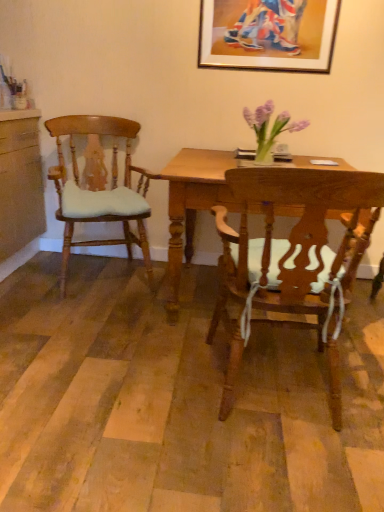
Question: In terms of width, does wooden picture frame at upper center look wider or thinner when compared to wooden desk at center?

Choices:
 (A) wide
 (B) thin

Answer: (B)

Question: From a real-world perspective, is wooden picture frame at upper center above or below wooden desk at center?

Choices:
 (A) below
 (B) above

Answer: (B)

Question: Estimate the real-world distances between objects in this image. Which object is farther from the wooden picture frame at upper center?

Choices:
 (A) wooden desk at center
 (B) wooden chair at center, the 1th chair when ordered from front to back
 (C) light brown wood chair at left, the 1th chair from the back

Answer: (B)

Question: Estimate the real-world distances between objects in this image. Which object is closer to the wooden picture frame at upper center?

Choices:
 (A) wooden desk at center
 (B) wooden chair at center, marked as the 1th chair in a right-to-left arrangement
 (C) light brown wood chair at left, placed as the second chair when sorted from right to left

Answer: (A)